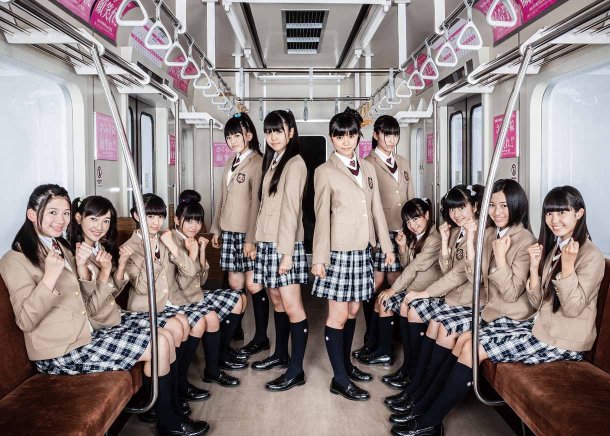
I want to click on handles, so click(158, 44).